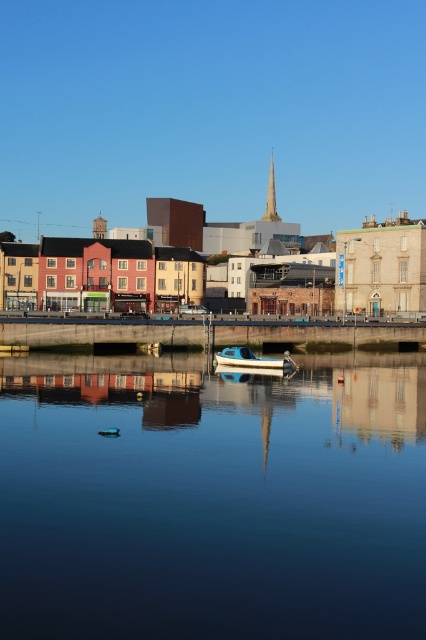
Question: Does smooth glass water at center have a lesser width compared to golden stone spire at center?

Choices:
 (A) yes
 (B) no

Answer: (B)

Question: Does smooth glass water at center appear under golden stone spire at center?

Choices:
 (A) no
 (B) yes

Answer: (B)

Question: Which of the following is the closest to the observer?

Choices:
 (A) smooth glass water at center
 (B) golden stone spire at center
 (C) white plastic boat at center
 (D) concrete dock at center

Answer: (A)

Question: Which of the following is the closest to the observer?

Choices:
 (A) (339, 484)
 (B) (210, 336)
 (C) (247, 348)

Answer: (A)

Question: Estimate the real-world distances between objects in this image. Which object is farther from the white plastic boat at center?

Choices:
 (A) concrete dock at center
 (B) smooth glass water at center

Answer: (B)

Question: From the image, what is the correct spatial relationship of smooth glass water at center in relation to concrete dock at center?

Choices:
 (A) right
 (B) left

Answer: (B)